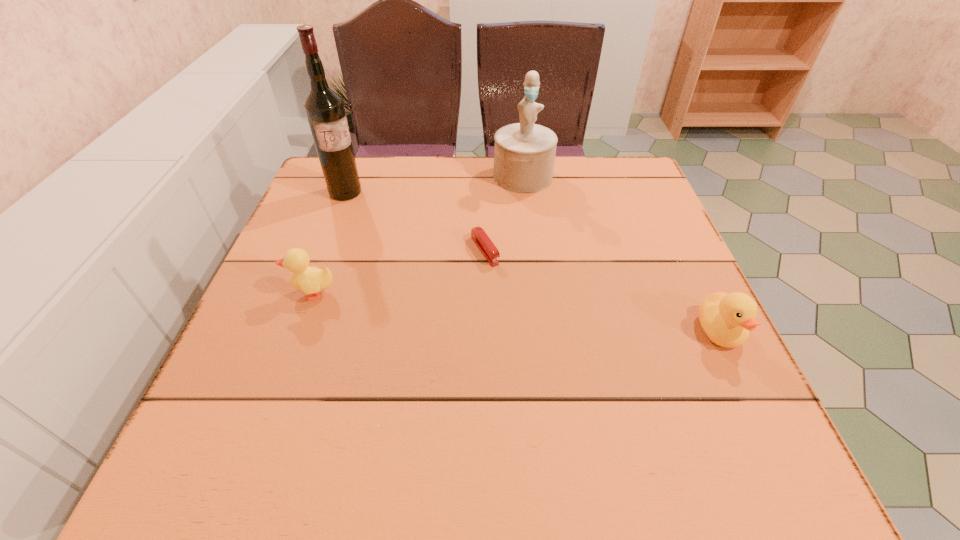
Identify which object is the third nearest to the figurine. Please provide its 2D coordinates. Your answer should be formatted as a tuple, i.e. [(x, y)], where the tuple contains the x and y coordinates of a point satisfying the conditions above.

[(726, 319)]

At what (x,y) coordinates should I click in order to perform the action: click on object that stands as the closest to the fourth farthest object. Please return your answer as a coordinate pair (x, y). This screenshot has height=540, width=960. Looking at the image, I should click on (483, 242).

Where is `free spot that satisfies the following two spatial constraints: 1. on the back side of the third farthest object; 2. on the left side of the figurine`? Image resolution: width=960 pixels, height=540 pixels. free spot that satisfies the following two spatial constraints: 1. on the back side of the third farthest object; 2. on the left side of the figurine is located at coordinates (484, 176).

The height and width of the screenshot is (540, 960). I want to click on vacant area that satisfies the following two spatial constraints: 1. on the front side of the farther duckling; 2. on the front-facing side of the tallest object, so click(308, 293).

Locate an element on the screen. This screenshot has width=960, height=540. vacant space that satisfies the following two spatial constraints: 1. on the front side of the left duckling; 2. on the front-facing side of the wine bottle is located at coordinates (308, 293).